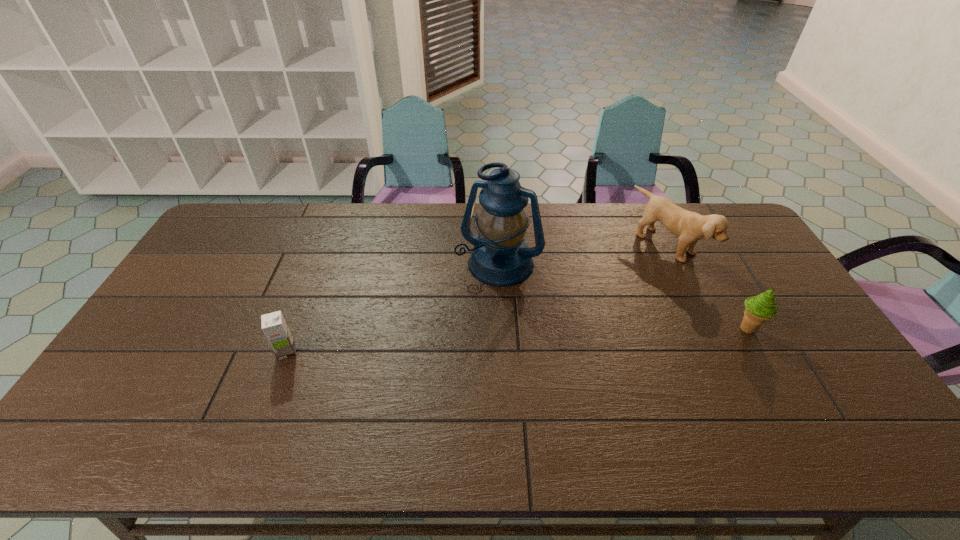
Find the location of a particular element. This screenshot has width=960, height=540. the shortest object is located at coordinates (274, 326).

This screenshot has height=540, width=960. Identify the location of chocolate milk. (274, 326).

The width and height of the screenshot is (960, 540). In order to click on the second nearest object in this screenshot , I will do `click(759, 309)`.

At what (x,y) coordinates should I click in order to perform the action: click on puppy. Please return your answer as a coordinate pair (x, y). Image resolution: width=960 pixels, height=540 pixels. Looking at the image, I should click on (690, 227).

Locate an element on the screen. The width and height of the screenshot is (960, 540). the tallest object is located at coordinates (500, 257).

Where is `the third object from right to left`? the third object from right to left is located at coordinates (500, 257).

This screenshot has height=540, width=960. Identify the location of vacant space located 0.330m on the left of the nearest object. (156, 352).

You are a GUI agent. You are given a task and a screenshot of the screen. Output one action in this format:
    pyautogui.click(x=<x>, y=<y>)
    Task: Click on the free space located on the back of the second nearest object
    The image size is (960, 540).
    Given the screenshot: What is the action you would take?
    pyautogui.click(x=712, y=265)

This screenshot has width=960, height=540. Find the location of `free space located on the left side of the puppy`. free space located on the left side of the puppy is located at coordinates (608, 293).

This screenshot has height=540, width=960. Identify the location of blank space located 0.350m on the left side of the puppy. (577, 313).